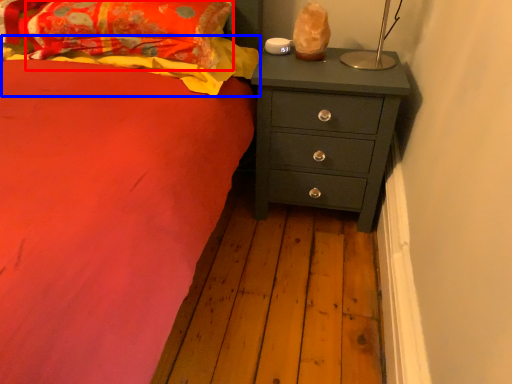
Question: Which point is closer to the camera, pillow (highlighted by a red box) or blanket (highlighted by a blue box)?

Choices:
 (A) pillow
 (B) blanket

Answer: (A)